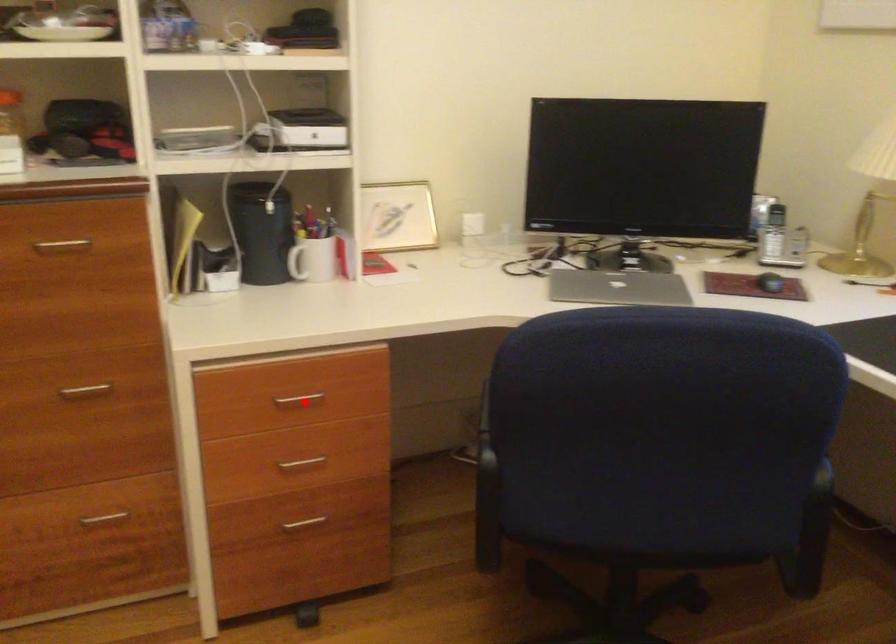
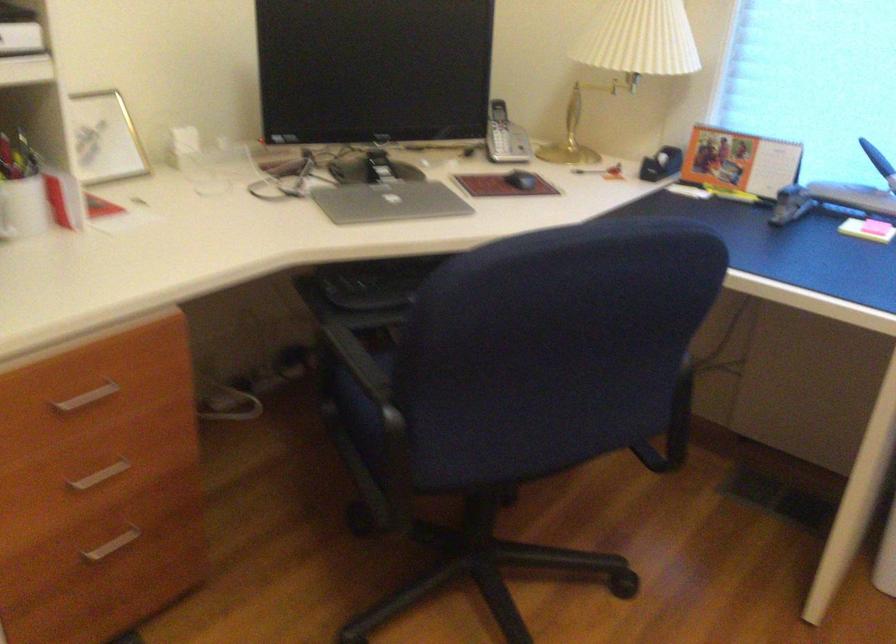
In the second image, find the point that corresponds to the highlighted location in the first image.

(87, 397)